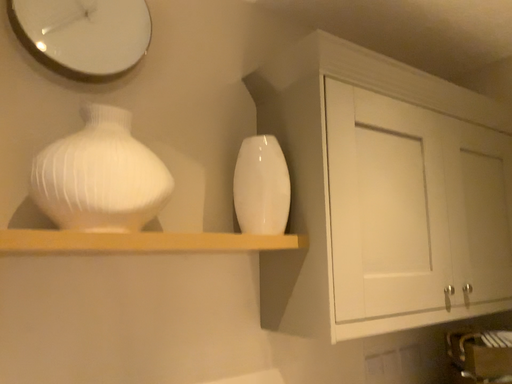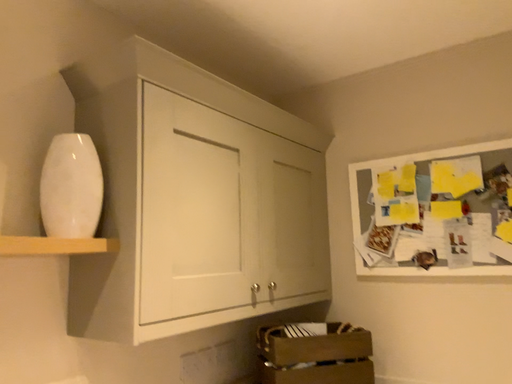
Question: Which way did the camera rotate in the video?

Choices:
 (A) rotated right
 (B) rotated left

Answer: (A)